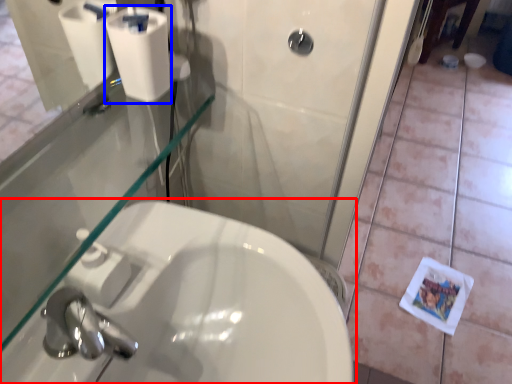
Question: Which object is closer to the camera taking this photo, sink (highlighted by a red box) or toilet paper (highlighted by a blue box)?

Choices:
 (A) sink
 (B) toilet paper

Answer: (A)